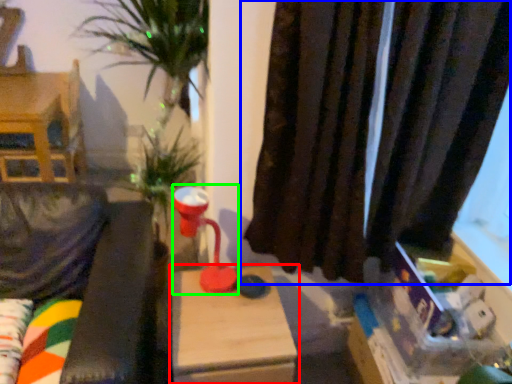
Question: Which object is the closest to the table (highlighted by a red box)? Choose among these: curtain (highlighted by a blue box) or table lamp (highlighted by a green box).

Choices:
 (A) curtain
 (B) table lamp

Answer: (B)